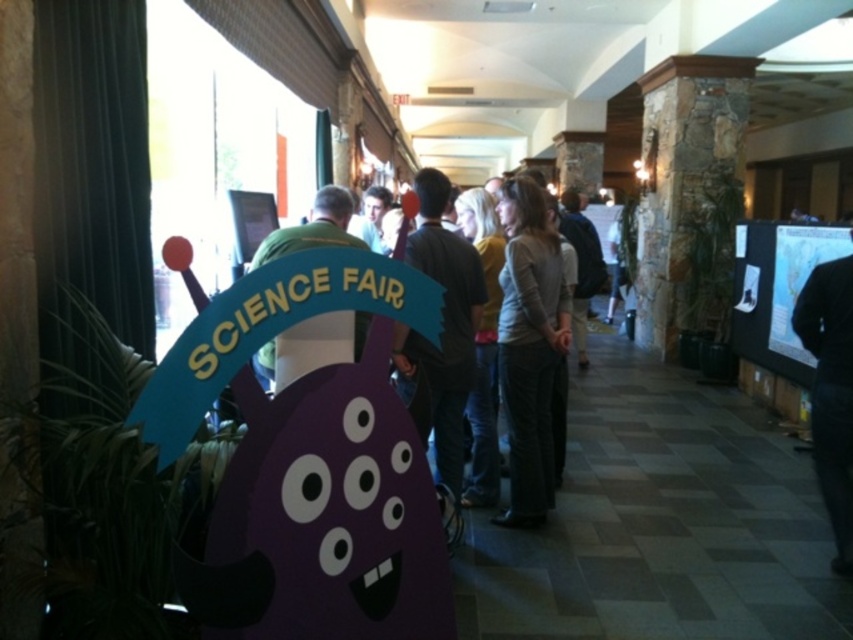
Does point (416, 262) lie behind point (839, 460)?

No, (416, 262) is closer to viewer.

Where is `dark gray sweater at center`? Image resolution: width=853 pixels, height=640 pixels. dark gray sweater at center is located at coordinates (442, 330).

Does point (706, 68) come farther from viewer compared to point (840, 378)?

Yes, point (706, 68) is behind point (840, 378).

Is stone at right positioned before black fabric at right?

No, stone at right is further to the viewer.

You are a GUI agent. You are given a task and a screenshot of the screen. Output one action in this format:
    pyautogui.click(x=<x>, y=<y>)
    Task: Click on the stone at right
    The width and height of the screenshot is (853, 640).
    Given the screenshot: What is the action you would take?
    pyautogui.click(x=682, y=173)

Locate an element on the screen. This screenshot has height=640, width=853. stone at right is located at coordinates (682, 173).

Is point (519, 419) in front of point (848, 467)?

No, it is not.

Does gray cotton sweater at center come behind black fabric at right?

That is True.

Does point (537, 244) come in front of point (834, 330)?

No, it is behind (834, 330).

In order to click on gray cotton sweater at center in this screenshot , I will do `click(529, 348)`.